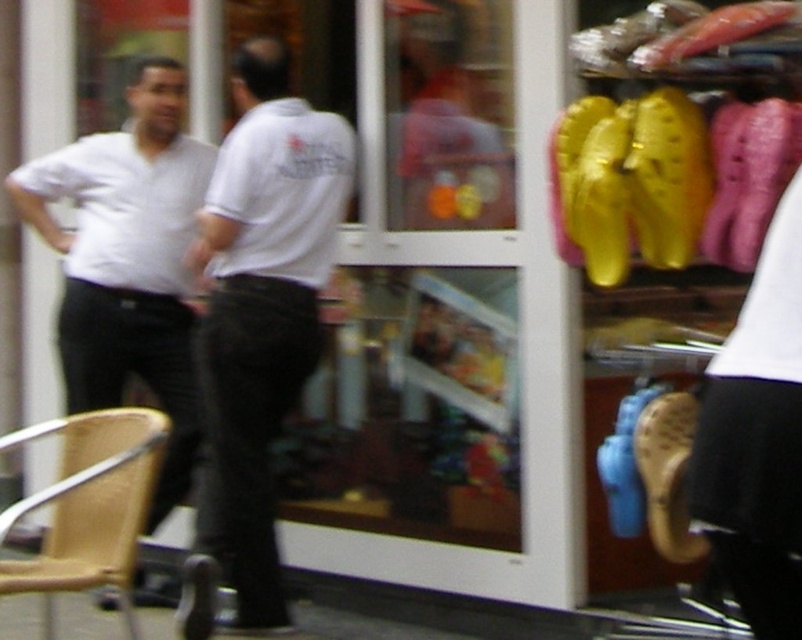
Question: Among these points, which one is nearest to the camera?

Choices:
 (A) (94, 358)
 (B) (160, 440)

Answer: (B)

Question: Is white matte shirt at center above wooden chair at lower left?

Choices:
 (A) yes
 (B) no

Answer: (A)

Question: Is white matte shirt at left closer to the viewer compared to wooden chair at lower left?

Choices:
 (A) yes
 (B) no

Answer: (B)

Question: Which point is farther from the camera taking this photo?

Choices:
 (A) (128, 550)
 (B) (95, 244)

Answer: (B)

Question: Which object is positioned closest to the wooden chair at lower left?

Choices:
 (A) white matte shirt at left
 (B) white matte shirt at center

Answer: (B)

Question: From the image, what is the correct spatial relationship of white matte shirt at center in relation to wooden chair at lower left?

Choices:
 (A) above
 (B) below

Answer: (A)